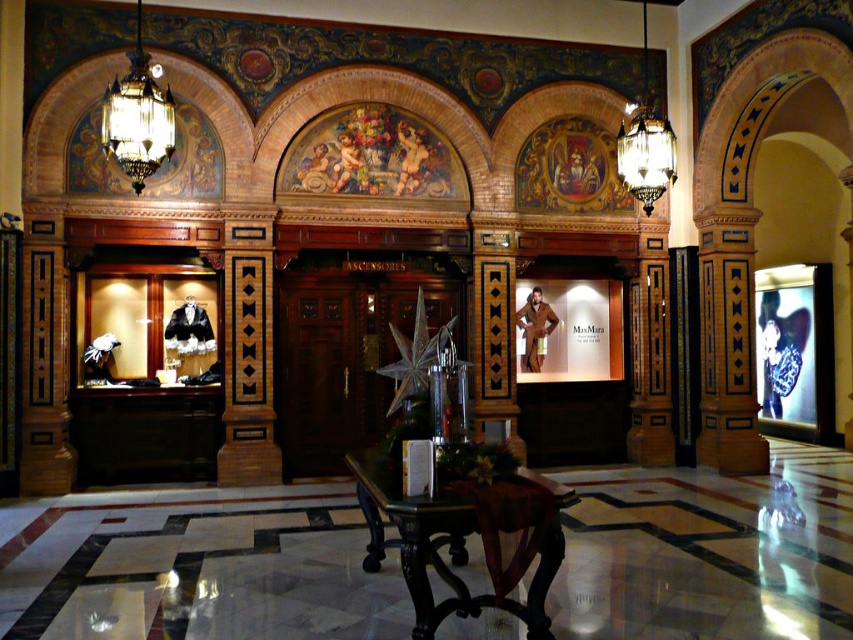
Can you confirm if dark wood table at center is positioned to the right of brown leather jacket at center?

No, dark wood table at center is not to the right of brown leather jacket at center.

Is point (372, 545) closer to camera compared to point (531, 369)?

Yes, it is.

You are a GUI agent. You are given a task and a screenshot of the screen. Output one action in this format:
    pyautogui.click(x=<x>, y=<y>)
    Task: Click on the dark wood table at center
    Image resolution: width=853 pixels, height=640 pixels.
    Given the screenshot: What is the action you would take?
    pyautogui.click(x=439, y=547)

Is point (469, 604) positioned in front of point (137, 58)?

Yes, it is.

Who is lower down, dark wood table at center or glass crystal chandelier at upper left?

dark wood table at center is lower down.

Which is behind, point (543, 570) or point (138, 116)?

Positioned behind is point (138, 116).

Find the location of a particular element. The width and height of the screenshot is (853, 640). dark wood table at center is located at coordinates (439, 547).

Between point (129, 68) and point (662, 147), which one is positioned behind?

Point (129, 68)

Which is more to the left, glass crystal chandelier at upper left or matte glass chandelier at upper center?

glass crystal chandelier at upper left is more to the left.

Locate an element on the screen. glass crystal chandelier at upper left is located at coordinates (137, 116).